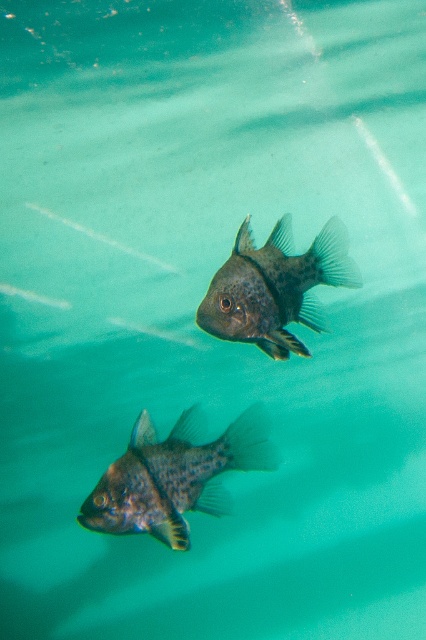
Can you confirm if speckled dark fish at bottom left is taller than speckled dark fish at center?

No.

Does point (129, 524) come closer to viewer compared to point (236, 314)?

No, it is behind (236, 314).

Describe the element at coordinates (175, 476) in the screenshot. The image size is (426, 640). I see `speckled dark fish at bottom left` at that location.

Locate an element on the screen. speckled dark fish at bottom left is located at coordinates (175, 476).